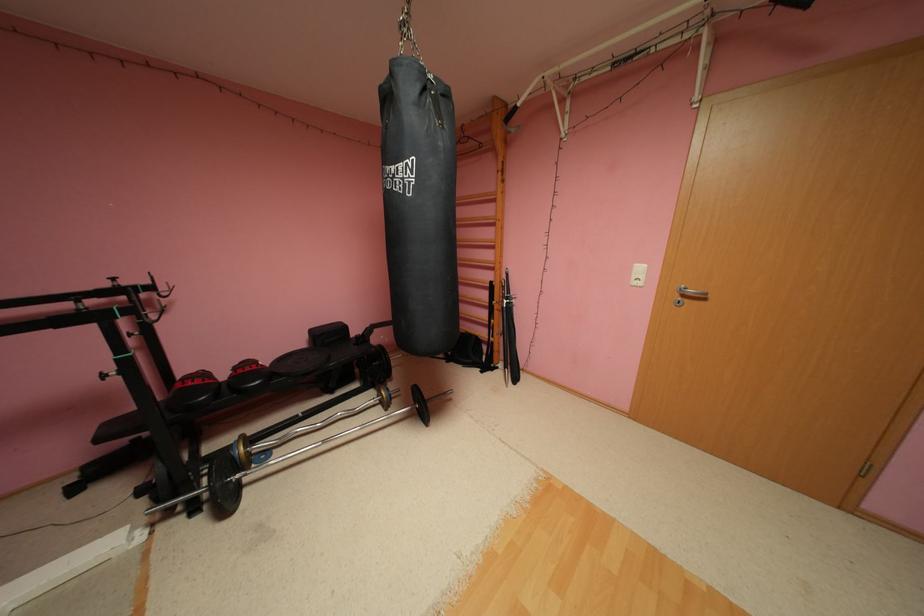
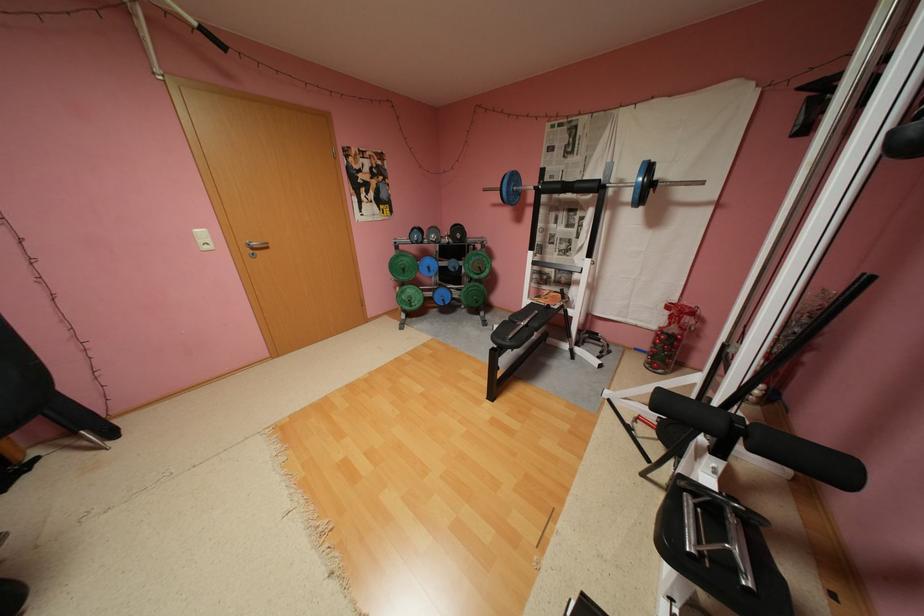
In the second image, find the point that corresponds to [691,296] in the first image.

(262, 249)